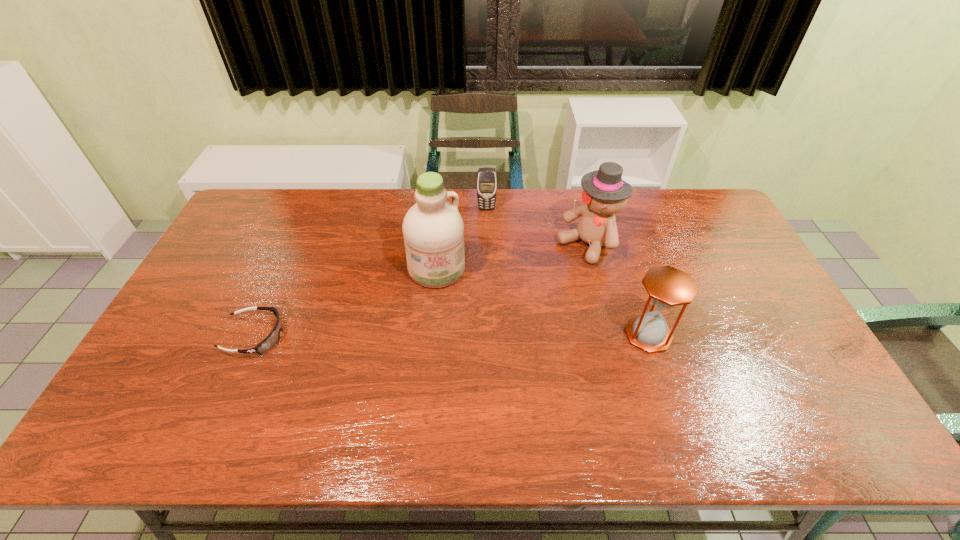
Find the location of `rag_doll situated at the far edge`. rag_doll situated at the far edge is located at coordinates (x=604, y=194).

Locate an element on the screen. This screenshot has width=960, height=540. free location at the far edge of the desktop is located at coordinates pyautogui.click(x=331, y=198).

Where is `vacant space at the near edge`? vacant space at the near edge is located at coordinates (256, 379).

In the image, there is a desktop. Where is `vacant space at the right edge`? The width and height of the screenshot is (960, 540). vacant space at the right edge is located at coordinates (740, 274).

This screenshot has height=540, width=960. Identify the location of vacant area at the far left corner. (272, 227).

Image resolution: width=960 pixels, height=540 pixels. What are the coordinates of `free space at the near left corner of the desktop` in the screenshot? It's located at (179, 375).

The height and width of the screenshot is (540, 960). Find the location of `free space that is in between the second tallest object and the cellular telephone`. free space that is in between the second tallest object and the cellular telephone is located at coordinates (537, 227).

Find the location of a particular element. The width and height of the screenshot is (960, 540). unoccupied position between the rag_doll and the third shortest object is located at coordinates (618, 289).

Locate an element on the screen. Image resolution: width=960 pixels, height=540 pixels. unoccupied position between the third shortest object and the cleansing agent is located at coordinates (542, 302).

This screenshot has height=540, width=960. What are the coordinates of `vacant area between the third object from right to left and the third shortest object` in the screenshot? It's located at (567, 272).